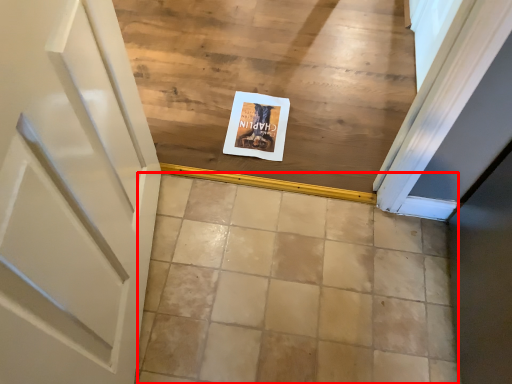
Question: From the image's perspective, where is ceramic tile (annotated by the red box) located relative to postcard?

Choices:
 (A) above
 (B) below

Answer: (B)